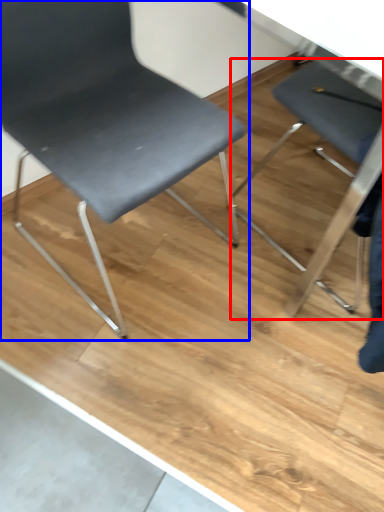
Question: Which object is further to the camera taking this photo, chair (highlighted by a red box) or chair (highlighted by a blue box)?

Choices:
 (A) chair
 (B) chair

Answer: (A)